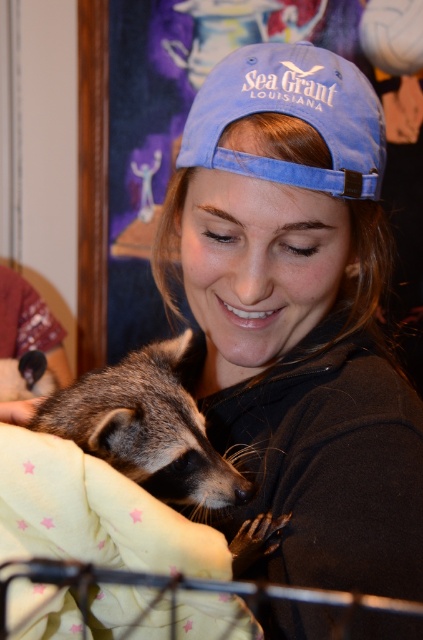
You are an interior designer working on a project. You need to place a new poster that is 10 inches wide at a position that is not occupied by any existing objects in the scene. The scene has a blue fabric baseball cap at upper center located at point (291, 115). Where should you place the new poster to ensure it doesn not overlap with the existing cap?

Place the new poster at a location different from point (291, 115) to avoid overlapping with the blue fabric baseball cap at upper center.

You are an interior designer assessing the layout of this room. You notice the blue fabric baseball cap at upper center and the fuzzy brown raccoon at lower left. Which object is positioned higher in the image?

The blue fabric baseball cap at upper center is positioned higher in the image than the fuzzy brown raccoon at lower left.

You are an interior designer asked to rearrange the furniture in the room. You notice the yellow fleece blanket at lower left and the fuzzy brown raccoon at lower left. Which object is closer to the left edge of the room?

The fuzzy brown raccoon at lower left is closer to the left edge of the room because the yellow fleece blanket at lower left is positioned to its right side.